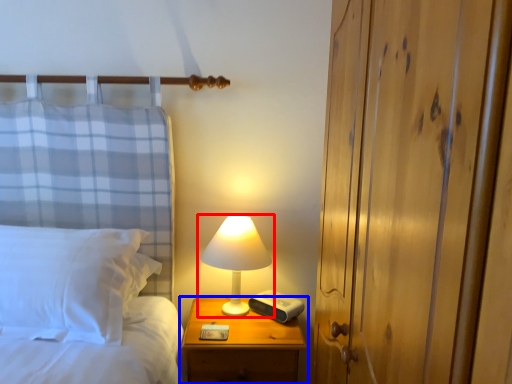
Question: Among these objects, which one is nearest to the camera, lamp (highlighted by a red box) or nightstand (highlighted by a blue box)?

Choices:
 (A) lamp
 (B) nightstand

Answer: (B)